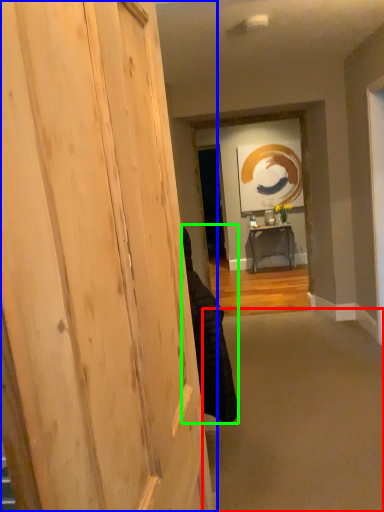
Question: Which object is the closest to the plain (highlighted by a red box)? Choose among these: door (highlighted by a blue box) or person (highlighted by a green box).

Choices:
 (A) door
 (B) person

Answer: (B)